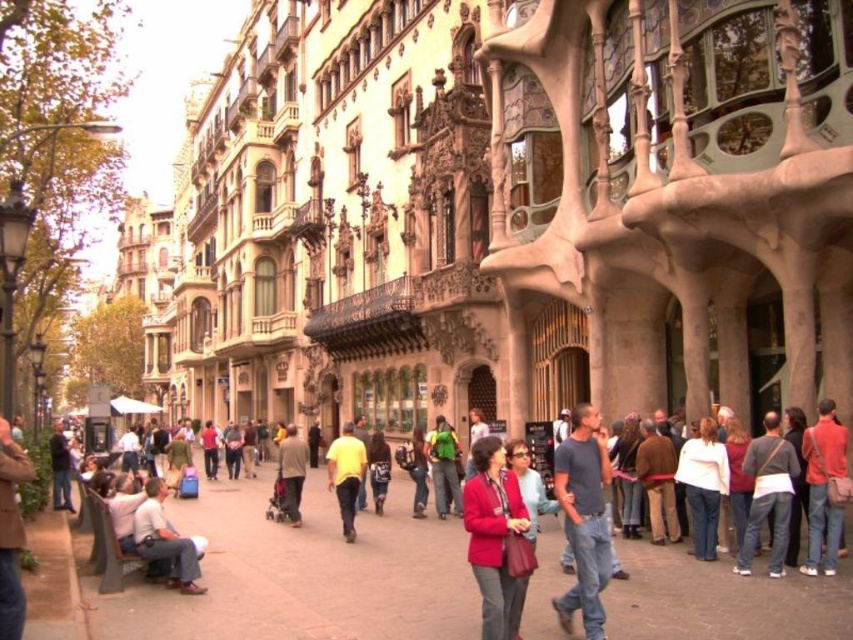
Question: Among these points, which one is farthest from the camera?

Choices:
 (A) (363, 452)
 (B) (781, 524)

Answer: (A)

Question: Is orange fabric shirt at lower right to the right of green fabric backpack at center from the viewer's perspective?

Choices:
 (A) yes
 (B) no

Answer: (A)

Question: Which object is positioned closest to the yellow matte shirt at center?

Choices:
 (A) green fabric backpack at center
 (B) orange fabric shirt at lower right
 (C) light brown leather jacket at lower left

Answer: (A)

Question: Is yellow matte shirt at center to the left of green fabric backpack at center from the viewer's perspective?

Choices:
 (A) no
 (B) yes

Answer: (B)

Question: Which of the following is the closest to the observer?

Choices:
 (A) (282, 467)
 (B) (141, 552)

Answer: (B)

Question: Can you confirm if dark blue t-shirt at center is wider than dark blue shirt at lower left?

Choices:
 (A) no
 (B) yes

Answer: (A)